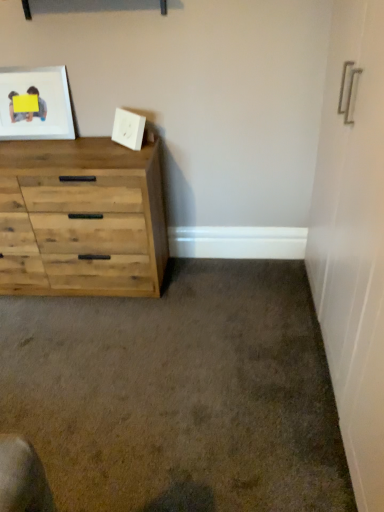
Identify the location of blank space situated above natural wood chest of drawers at left (from a real-world perspective). The width and height of the screenshot is (384, 512). (47, 143).